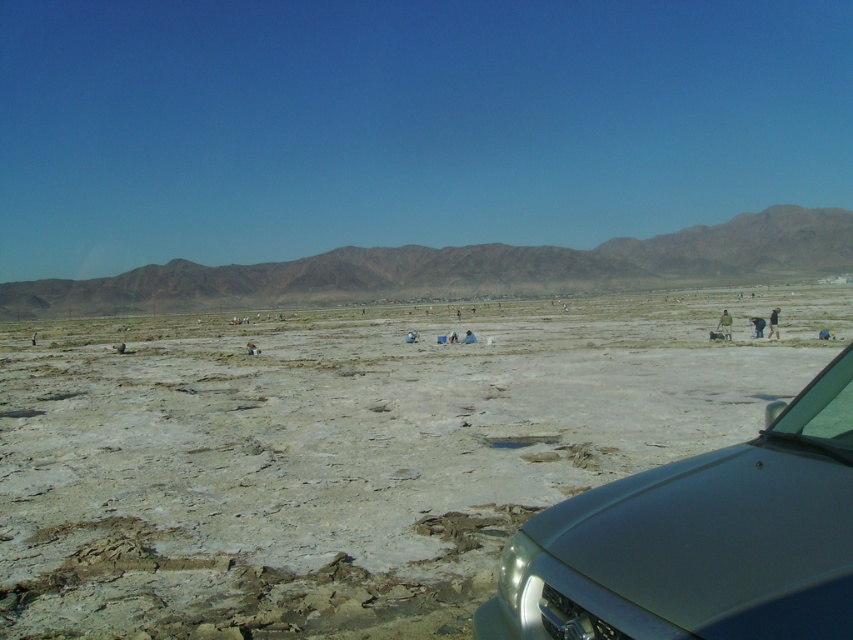
Consider the image. Which is more to the right, gray sandy dirt field at center or brown rocky mountain at upper center?

From the viewer's perspective, brown rocky mountain at upper center appears more on the right side.

Between gray sandy dirt field at center and brown rocky mountain at upper center, which one is positioned higher?

brown rocky mountain at upper center is above.

Is point (74, 378) farther from camera compared to point (244, 284)?

No, it is not.

Where is `gray sandy dirt field at center`? Image resolution: width=853 pixels, height=640 pixels. gray sandy dirt field at center is located at coordinates (346, 452).

Is brown fabric person at lower right above dark blue jeans at center?

No, brown fabric person at lower right is not above dark blue jeans at center.

Which is below, brown fabric person at lower right or dark blue jeans at center?

Positioned lower is brown fabric person at lower right.

Who is more distant from viewer, [718,328] or [775,312]?

Positioned behind is point [775,312].

Where is `brown fabric person at lower right`? brown fabric person at lower right is located at coordinates (724, 324).

Is gray sandy dirt field at center closer to camera compared to satin silver car at lower right?

No, it is not.

Can you confirm if gray sandy dirt field at center is smaller than satin silver car at lower right?

Actually, gray sandy dirt field at center might be larger than satin silver car at lower right.

Find the location of a particular element. gray sandy dirt field at center is located at coordinates (346, 452).